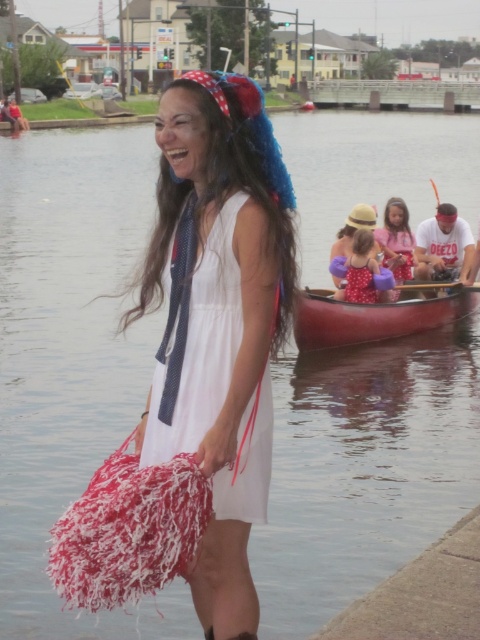
Is red and white fabric headdress at upper center bigger than polka dot dress at center?

Incorrect, red and white fabric headdress at upper center is not larger than polka dot dress at center.

Is point (271, 186) positioned before point (385, 209)?

That is True.

You are a GUI agent. You are given a task and a screenshot of the screen. Output one action in this format:
    pyautogui.click(x=<x>, y=<y>)
    Task: Click on the red and white fabric headdress at upper center
    This screenshot has width=480, height=640.
    Given the screenshot: What is the action you would take?
    pyautogui.click(x=251, y=125)

Looking at this image, is white fabric dress at center further to camera compared to polka dot fabric dress at center?

No, it is in front of polka dot fabric dress at center.

Who is lower down, white fabric dress at center or polka dot fabric dress at center?

white fabric dress at center is lower down.

Between point (206, 577) and point (347, 272), which one is positioned behind?

Point (347, 272)

I want to click on white fabric dress at center, so click(217, 320).

Is white cotton dress at center wider than smooth wood canoe at center?

No, white cotton dress at center is not wider than smooth wood canoe at center.

Which is behind, point (153, 456) or point (454, 291)?

Positioned behind is point (454, 291).

Does point (208, 401) come closer to viewer compared to point (355, 340)?

Yes.

Find the location of a particular element. The image size is (480, 640). white cotton dress at center is located at coordinates (202, 346).